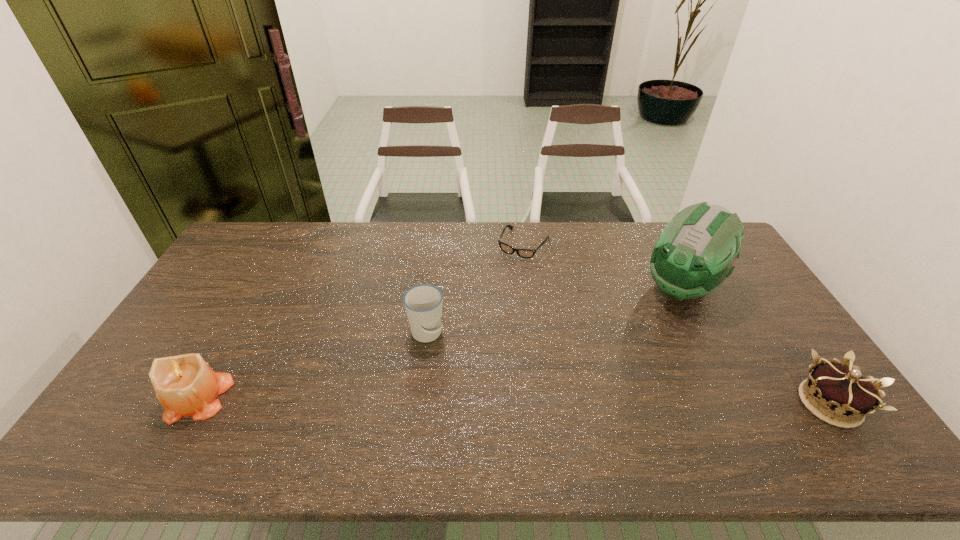
In the image, there is a desktop. Where is `vacant space at the left edge`? The image size is (960, 540). vacant space at the left edge is located at coordinates (242, 279).

Where is `vacant region at the right edge of the desktop`? vacant region at the right edge of the desktop is located at coordinates (764, 358).

Locate an element on the screen. free space at the far left corner is located at coordinates (264, 236).

Image resolution: width=960 pixels, height=540 pixels. Find the location of `vacant space that's between the tallest object and the shortest object`. vacant space that's between the tallest object and the shortest object is located at coordinates (603, 266).

You are a GUI agent. You are given a task and a screenshot of the screen. Output one action in this format:
    pyautogui.click(x=<x>, y=<y>)
    Task: Click on the unoccupied position between the crown and the fourth object from right to left
    The width and height of the screenshot is (960, 540).
    Given the screenshot: What is the action you would take?
    pyautogui.click(x=628, y=369)

Identify the location of free space that is in between the leftmost object and the crown. (515, 401).

Where is `vacant area that lies between the crown and the candle`? This screenshot has height=540, width=960. vacant area that lies between the crown and the candle is located at coordinates (515, 401).

Identify the location of unoccupied area between the candle and the football helmet. (441, 342).

In order to click on free space between the third object from right to left and the crown in this screenshot , I will do `click(677, 323)`.

Identify the location of free space between the crown and the leftmost object. (515, 401).